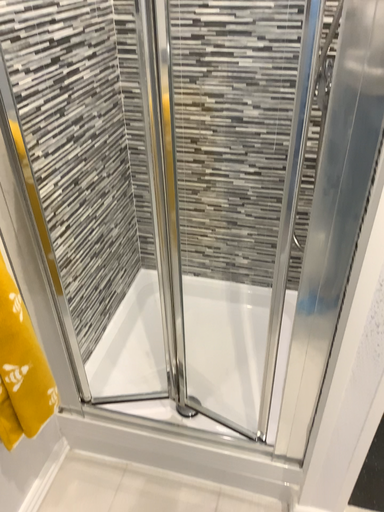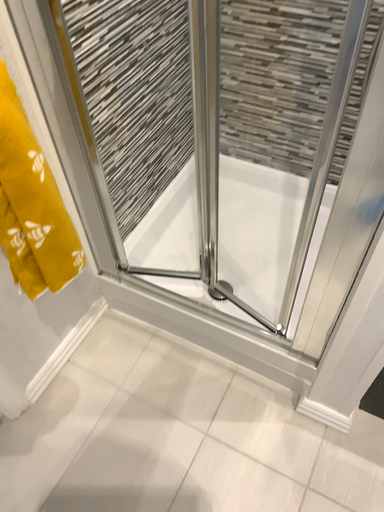
Question: How did the camera likely rotate when shooting the video?

Choices:
 (A) rotated downward
 (B) rotated upward

Answer: (A)